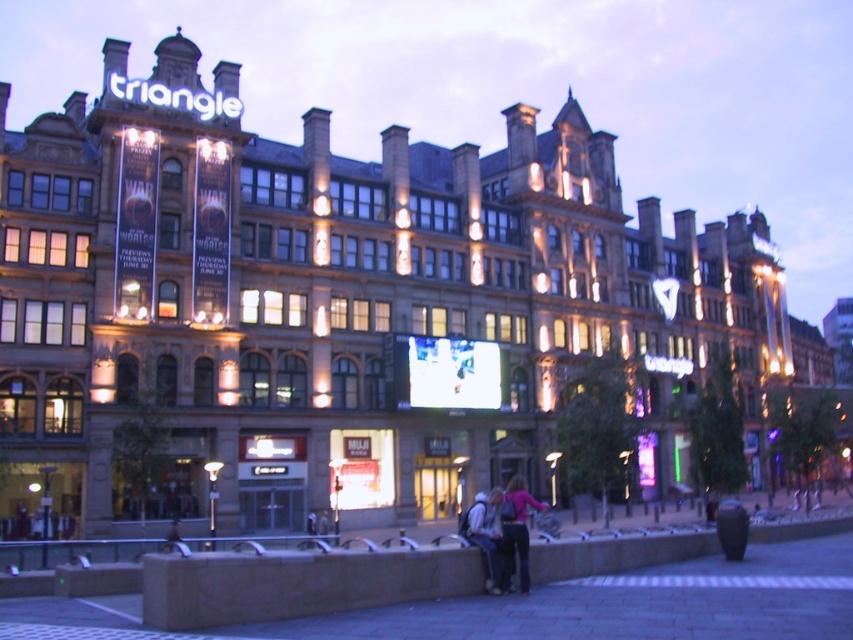
Question: Is dark pink sweater at lower center to the right of denim jacket at lower center from the viewer's perspective?

Choices:
 (A) no
 (B) yes

Answer: (B)

Question: Does dark pink sweater at lower center appear on the right side of denim jacket at lower center?

Choices:
 (A) yes
 (B) no

Answer: (A)

Question: Which object appears closest to the camera in this image?

Choices:
 (A) denim jacket at lower center
 (B) dark pink sweater at lower center

Answer: (A)

Question: Does dark pink sweater at lower center have a larger size compared to denim jacket at lower center?

Choices:
 (A) no
 (B) yes

Answer: (B)